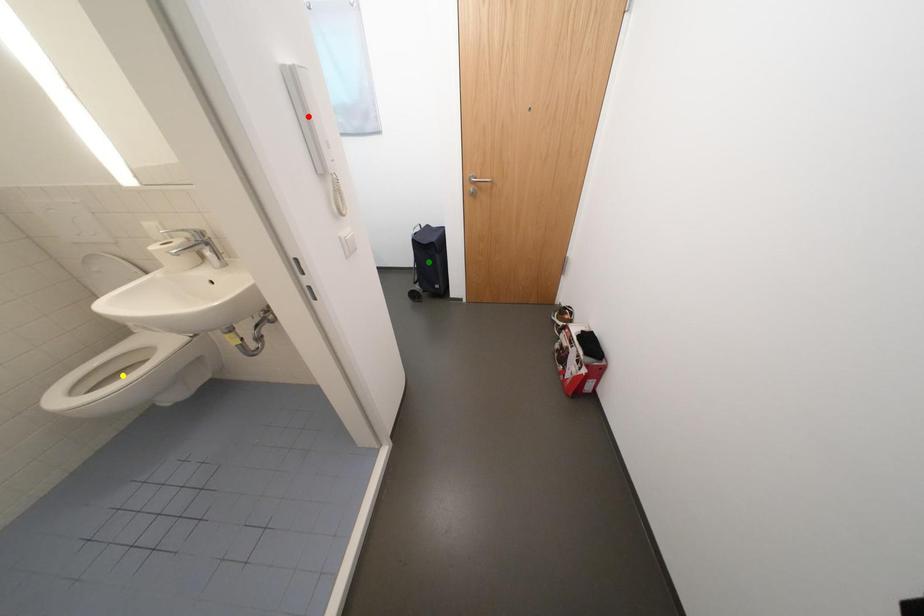
Order these from nearest to farthest:
yellow point | red point | green point

red point → yellow point → green point